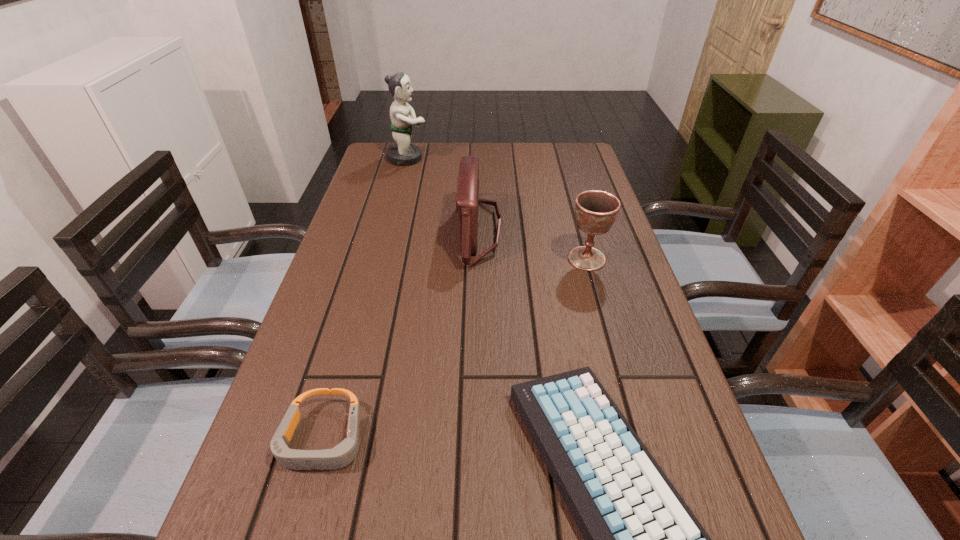
The height and width of the screenshot is (540, 960). Find the location of `object that is at the far edge`. object that is at the far edge is located at coordinates (402, 153).

Where is `figurine that is at the left edge`? figurine that is at the left edge is located at coordinates (402, 153).

Identify the location of goggles present at the left edge. This screenshot has width=960, height=540. (344, 453).

Image resolution: width=960 pixels, height=540 pixels. I want to click on object that is at the right edge, so click(x=596, y=211).

At what (x,y) coordinates should I click in order to perform the action: click on object located in the far left corner section of the desktop. Please return your answer as a coordinate pair (x, y). Image resolution: width=960 pixels, height=540 pixels. Looking at the image, I should click on (402, 153).

In the image, there is a desktop. Where is `free region at the far edge`? The height and width of the screenshot is (540, 960). free region at the far edge is located at coordinates (526, 147).

This screenshot has width=960, height=540. What are the coordinates of `vacant area at the left edge of the desktop` in the screenshot? It's located at (351, 463).

Image resolution: width=960 pixels, height=540 pixels. Identify the location of vacant space at the right edge of the desktop. (583, 246).

Locate an element on the screen. vacant area at the far left corner of the desktop is located at coordinates (391, 162).

In the image, there is a desktop. What are the coordinates of `free region at the far right corner` in the screenshot? It's located at (551, 144).